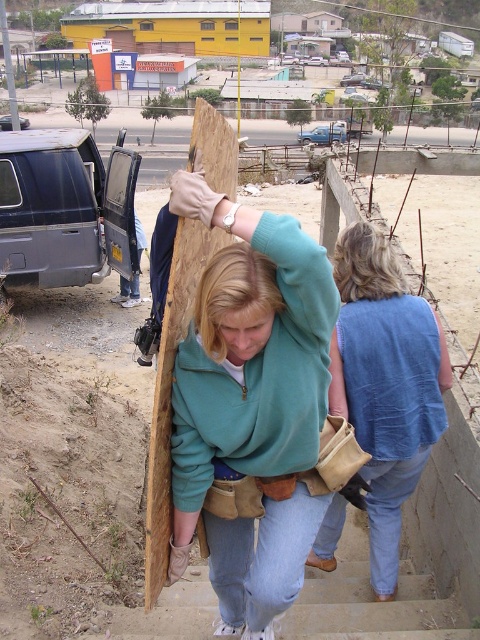
Question: Can you confirm if teal fleece sweatshirt at center is positioned below blue knitted vest at upper right?

Choices:
 (A) no
 (B) yes

Answer: (B)

Question: Which object appears closest to the camera in this image?

Choices:
 (A) blue knitted vest at upper right
 (B) teal fleece sweatshirt at center

Answer: (B)

Question: Does teal fleece sweatshirt at center appear over blue knitted vest at upper right?

Choices:
 (A) no
 (B) yes

Answer: (A)

Question: Based on their relative distances, which object is nearer to the wooden plank at center?

Choices:
 (A) blue knitted vest at upper right
 (B) teal fleece sweatshirt at center

Answer: (B)

Question: From the image, what is the correct spatial relationship of teal fleece sweatshirt at center in relation to wooden plank at center?

Choices:
 (A) left
 (B) right

Answer: (B)

Question: Which object is farther from the camera taking this photo?

Choices:
 (A) wooden plank at center
 (B) teal fleece sweatshirt at center

Answer: (A)